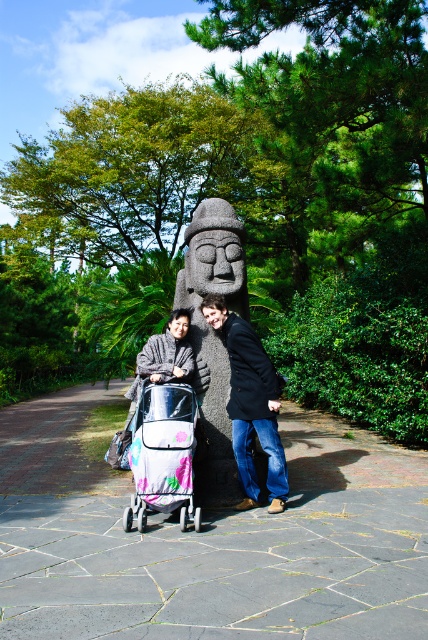
The image size is (428, 640). Describe the element at coordinates (214, 337) in the screenshot. I see `dark gray stone statue at center` at that location.

Locate an element on the screen. dark gray stone statue at center is located at coordinates (214, 337).

Locate an element on the screen. The height and width of the screenshot is (640, 428). dark gray stone statue at center is located at coordinates (214, 337).

Based on the photo, who is positioned more to the right, dark gray stone statue at center or white fabric baby carriage at center?

dark gray stone statue at center

In order to click on dark gray stone statue at center in this screenshot , I will do `click(214, 337)`.

Who is positioned more to the left, black matte jacket at center or gray woolen sweater at center?

From the viewer's perspective, gray woolen sweater at center appears more on the left side.

Describe the element at coordinates (250, 404) in the screenshot. This screenshot has height=640, width=428. I see `black matte jacket at center` at that location.

You are a GUI agent. You are given a task and a screenshot of the screen. Output one action in this format:
    pyautogui.click(x=<x>, y=<y>)
    Task: Click on the black matte jacket at center
    
    Given the screenshot: What is the action you would take?
    pyautogui.click(x=250, y=404)